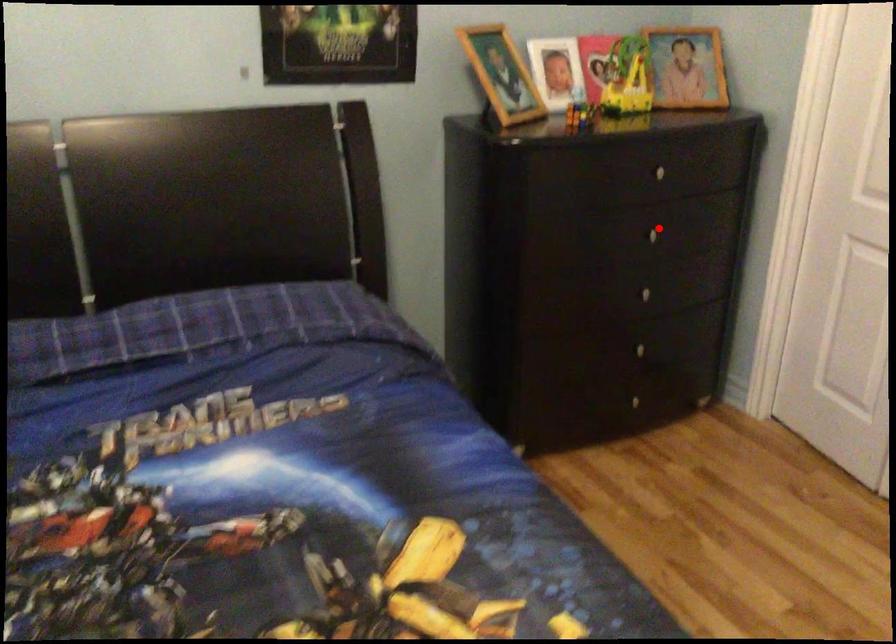
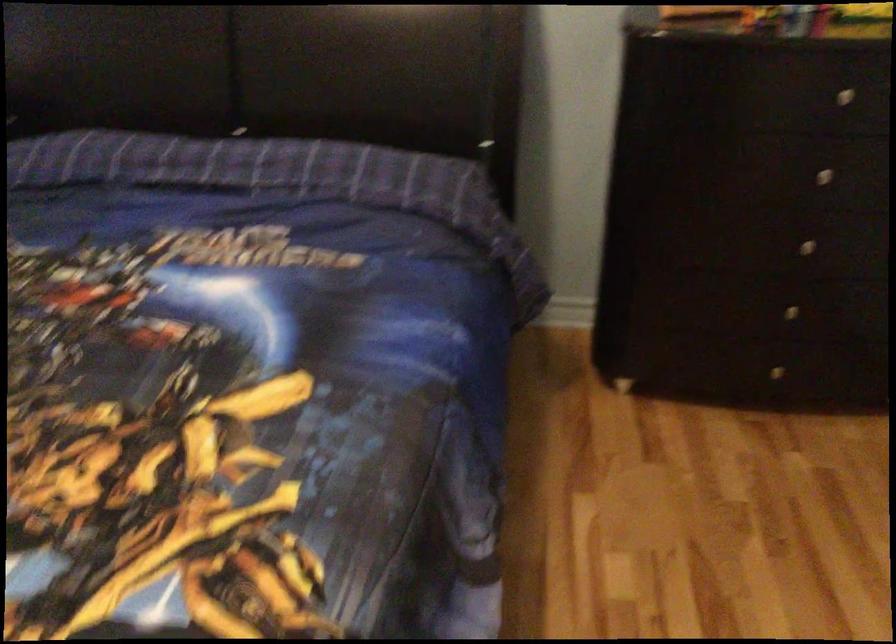
Where in the second image is the point corresponding to the highlighted location from the first image?

(833, 169)